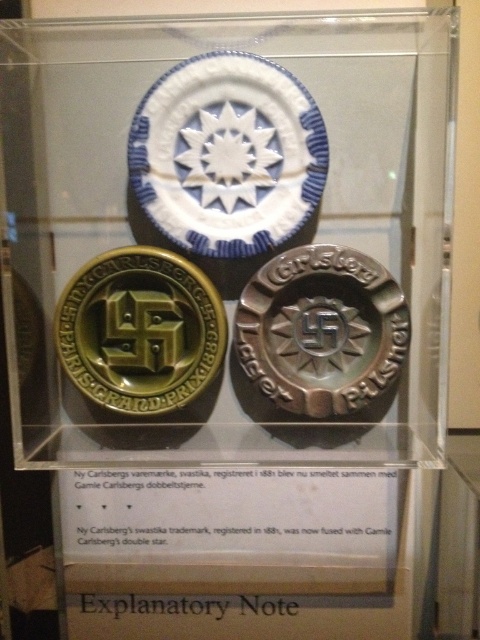
Describe the element at coordinates (322, 330) in the screenshot. I see `brushed metal badge at center` at that location.

How distant is brushed metal badge at center from gold matte swastika at left?

brushed metal badge at center and gold matte swastika at left are 5.53 inches apart.

This screenshot has width=480, height=640. What do you see at coordinates (322, 330) in the screenshot?
I see `brushed metal badge at center` at bounding box center [322, 330].

You are a GUI agent. You are given a task and a screenshot of the screen. Output one action in this format:
    pyautogui.click(x=<x>, y=<y>)
    Task: Click on the brushed metal badge at center
    The height and width of the screenshot is (640, 480).
    Given the screenshot: What is the action you would take?
    pyautogui.click(x=322, y=330)